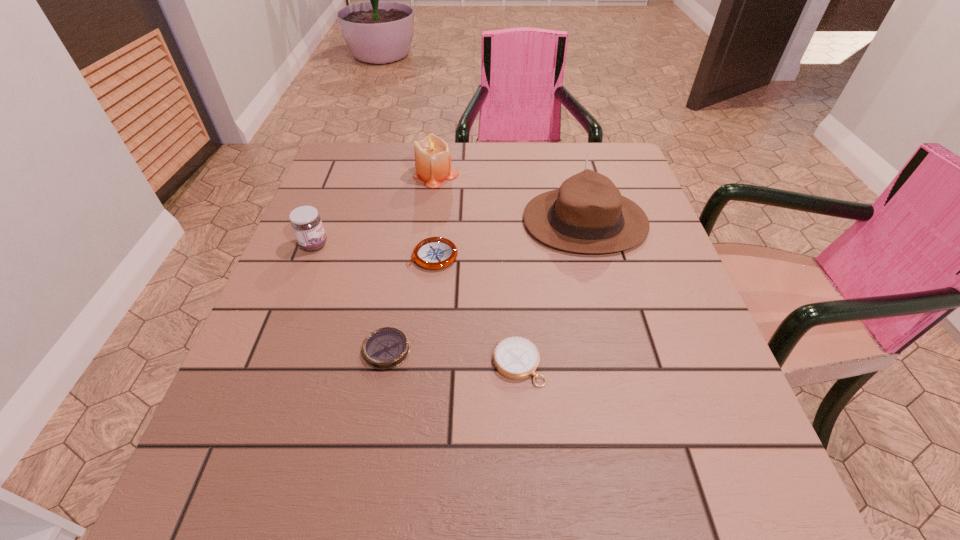
The image size is (960, 540). I want to click on fedora, so click(587, 214).

Where is `the farthest object`? This screenshot has width=960, height=540. the farthest object is located at coordinates (432, 157).

Identify the location of the leftmost object. The width and height of the screenshot is (960, 540). (306, 223).

I want to click on jam, so click(x=306, y=223).

Where is `the tallest compass`? the tallest compass is located at coordinates (433, 253).

This screenshot has width=960, height=540. I want to click on the farthest compass, so click(433, 253).

Locate an element on the screen. The image size is (960, 540). the rightmost compass is located at coordinates (517, 358).

Identify the location of the shortest compass. (385, 348).

Locate an element on the screen. vacant space located on the feather side of the fedora is located at coordinates (423, 221).

At what (x,y) coordinates should I click in order to perform the action: click on vacant space situated on the feather side of the fedora. Please return your answer as a coordinate pair (x, y). The height and width of the screenshot is (540, 960). Looking at the image, I should click on (356, 221).